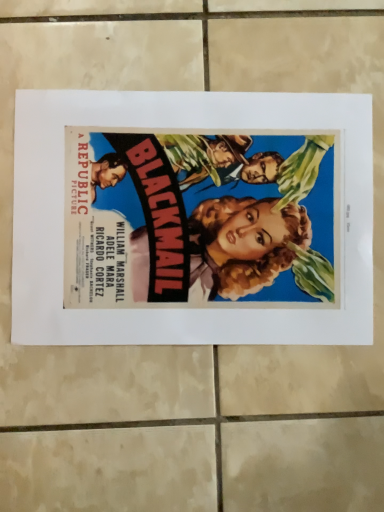
This screenshot has height=512, width=384. I want to click on matte paper poster at center, so click(192, 218).

The width and height of the screenshot is (384, 512). What do you see at coordinates (192, 218) in the screenshot?
I see `matte paper poster at center` at bounding box center [192, 218].

The height and width of the screenshot is (512, 384). Identify the location of matte paper poster at center. (192, 218).